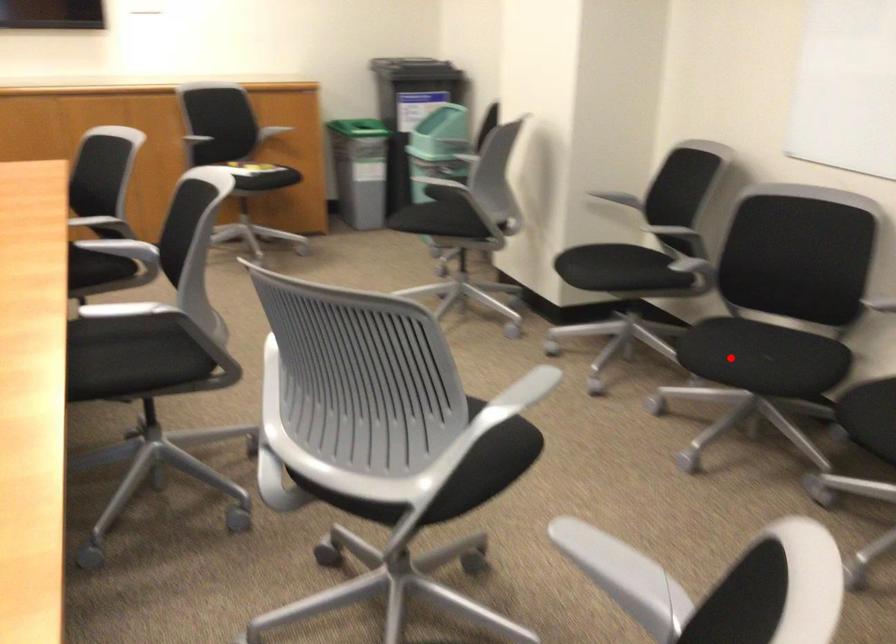
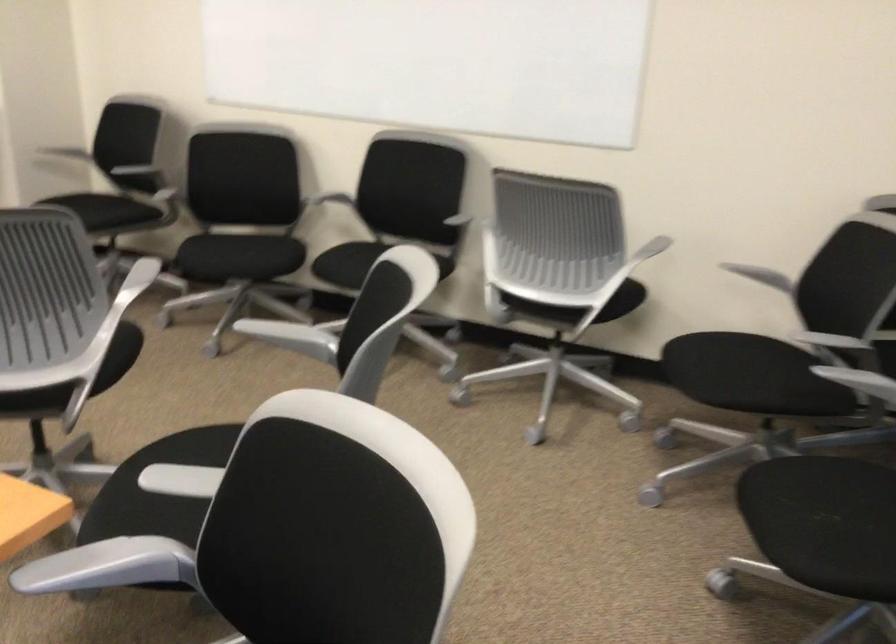
Question: I am providing you with two images of the same scene from different viewpoints. Image1 has a red point marked. In image2, the corresponding 3D location appears at what relative position? Reply with the corresponding letter.

Choices:
 (A) Closer
 (B) Farther

Answer: (B)